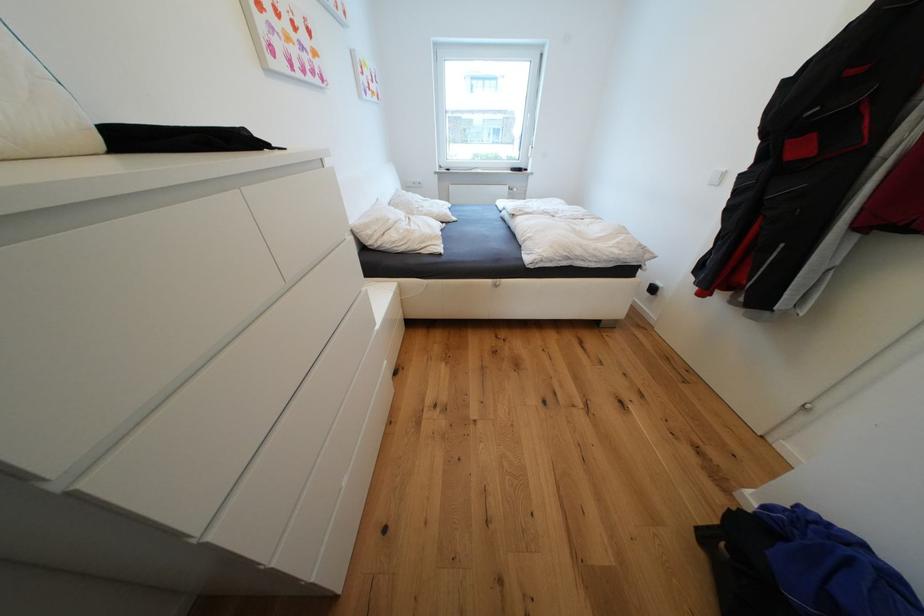
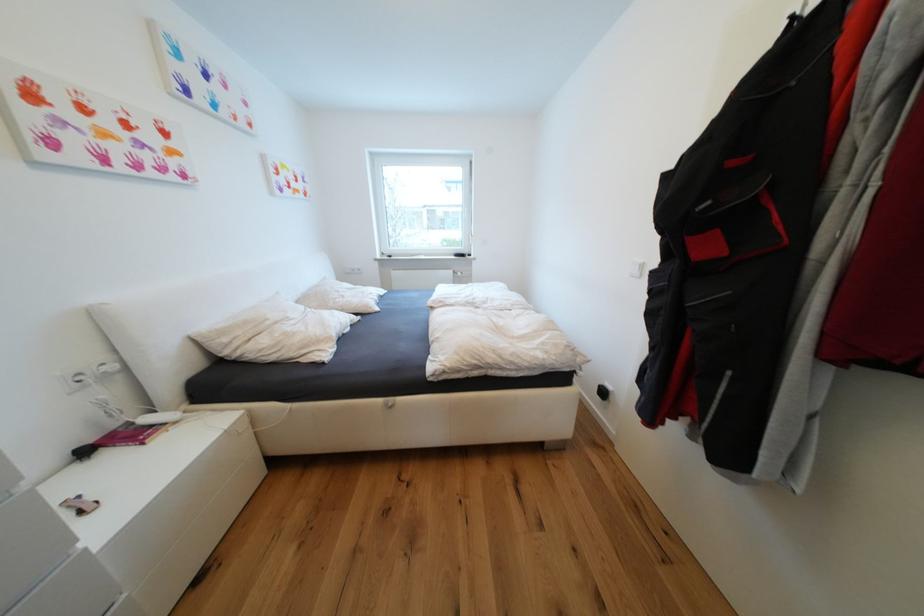
What movement of the cameraman would produce the second image?

The cameraman moved toward right, forward.